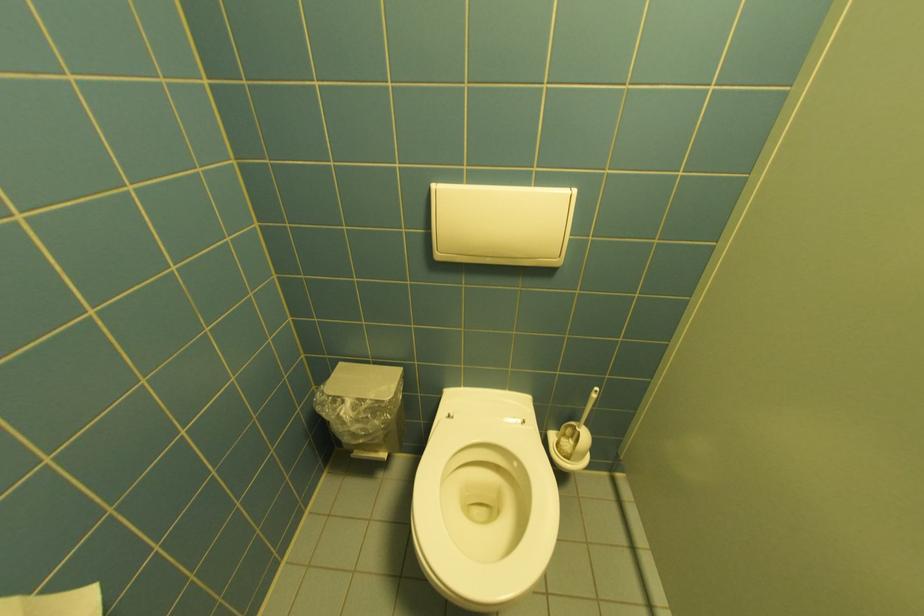
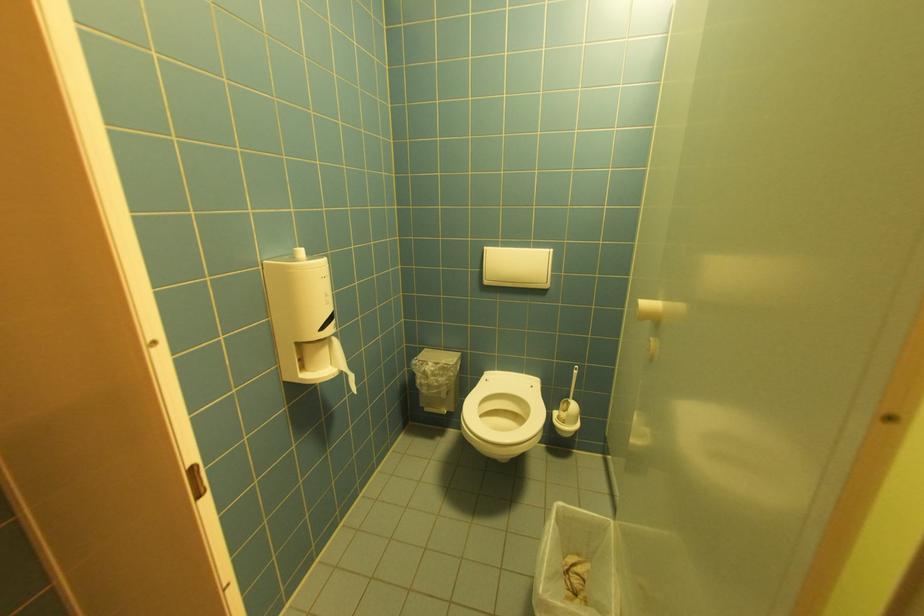
In the second image, find the point that corresponds to point 444,256 in the first image.

(492, 283)